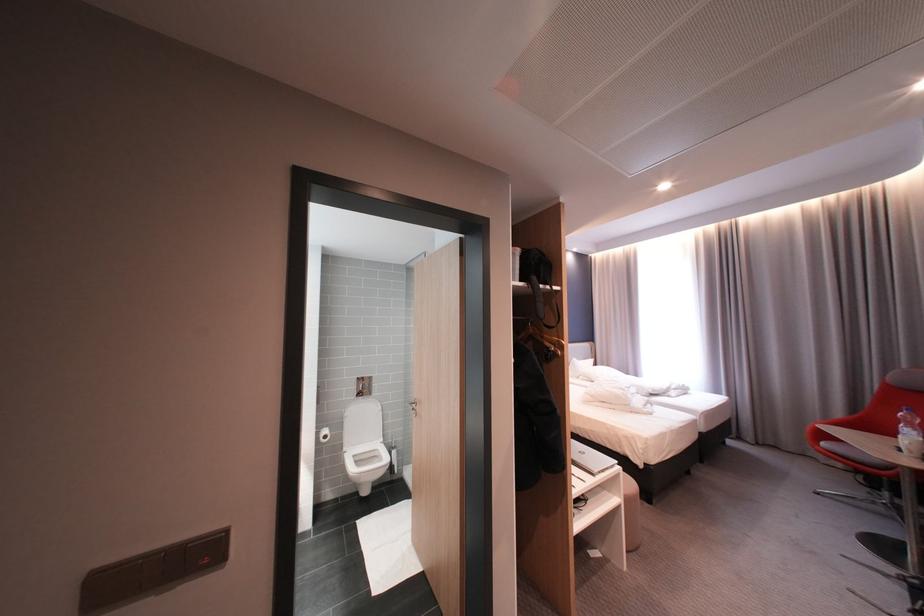
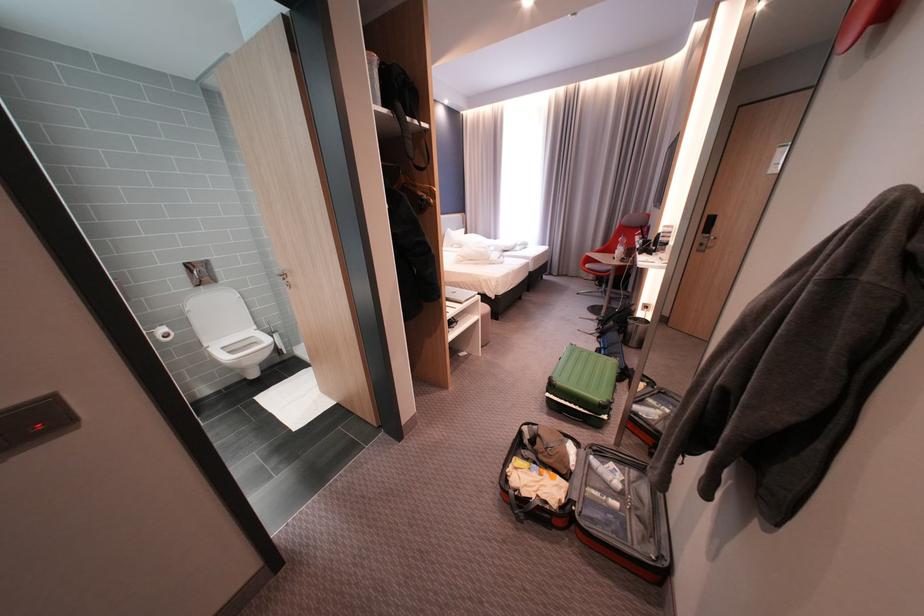
Where in the second image is the point corresponding to (x=393, y=440) from the first image?

(266, 328)